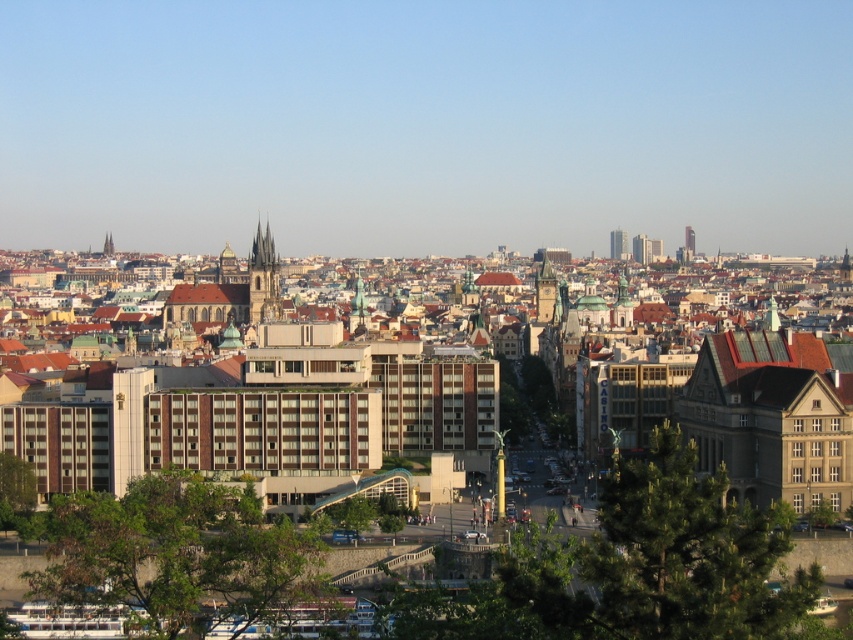
Is golden stone clock tower at center positioned behind glassy skyscraper at upper right?

No, golden stone clock tower at center is in front of glassy skyscraper at upper right.

Can you confirm if golden stone clock tower at center is smaller than glassy skyscraper at upper right?

No.

Identify the location of golden stone clock tower at center. (544, 289).

Does dark brown stone tower at center-left have a lesser height compared to brown stone tower at upper center?

Incorrect, dark brown stone tower at center-left's height does not fall short of brown stone tower at upper center's.

Does point (259, 244) come in front of point (109, 252)?

Yes, point (259, 244) is in front of point (109, 252).

Is point (268, 252) less distant than point (105, 240)?

Yes, it is in front of point (105, 240).

Identify the location of dark brown stone tower at center-left. 263,278.

Does dark brown stone tower at center-left appear on the right side of glassy skyscraper at upper right?

No, dark brown stone tower at center-left is not to the right of glassy skyscraper at upper right.

Does dark brown stone tower at center-left have a greater height compared to glassy skyscraper at upper right?

Yes.

Where is `dark brown stone tower at center-left`? dark brown stone tower at center-left is located at coordinates (263, 278).